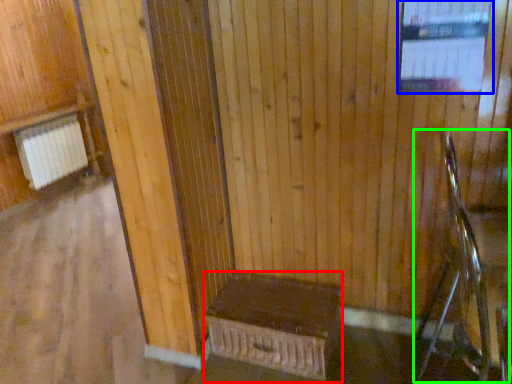
Question: Which object is positioned closest to furniture (highlighted by a red box)? Select from window (highlighted by a blue box) and rocking chair (highlighted by a green box).

Choices:
 (A) window
 (B) rocking chair

Answer: (B)